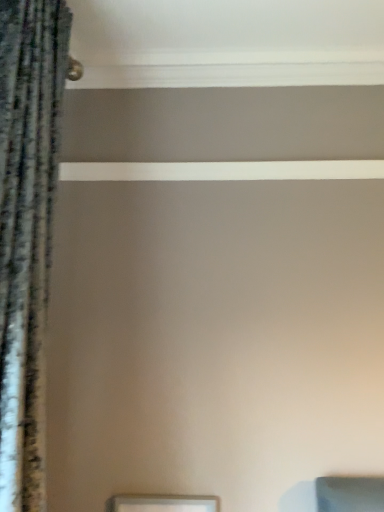
Question: Based on their positions, is velvet-like dark gray curtain at left located to the left or right of matte silver picture frame at lower center?

Choices:
 (A) left
 (B) right

Answer: (A)

Question: From a real-world perspective, is velvet-like dark gray curtain at left physically located above or below matte silver picture frame at lower center?

Choices:
 (A) above
 (B) below

Answer: (A)

Question: From the image's perspective, relative to matte silver picture frame at lower center, is velvet-like dark gray curtain at left above or below?

Choices:
 (A) below
 (B) above

Answer: (B)

Question: From their relative heights in the image, would you say matte silver picture frame at lower center is taller or shorter than velvet-like dark gray curtain at left?

Choices:
 (A) tall
 (B) short

Answer: (B)

Question: Choose the correct answer: Is matte silver picture frame at lower center inside velvet-like dark gray curtain at left or outside it?

Choices:
 (A) inside
 (B) outside

Answer: (B)

Question: Is point click(x=117, y=501) closer or farther from the camera than point click(x=56, y=47)?

Choices:
 (A) closer
 (B) farther

Answer: (B)

Question: From a real-world perspective, is matte silver picture frame at lower center physically located above or below velvet-like dark gray curtain at left?

Choices:
 (A) above
 (B) below

Answer: (B)